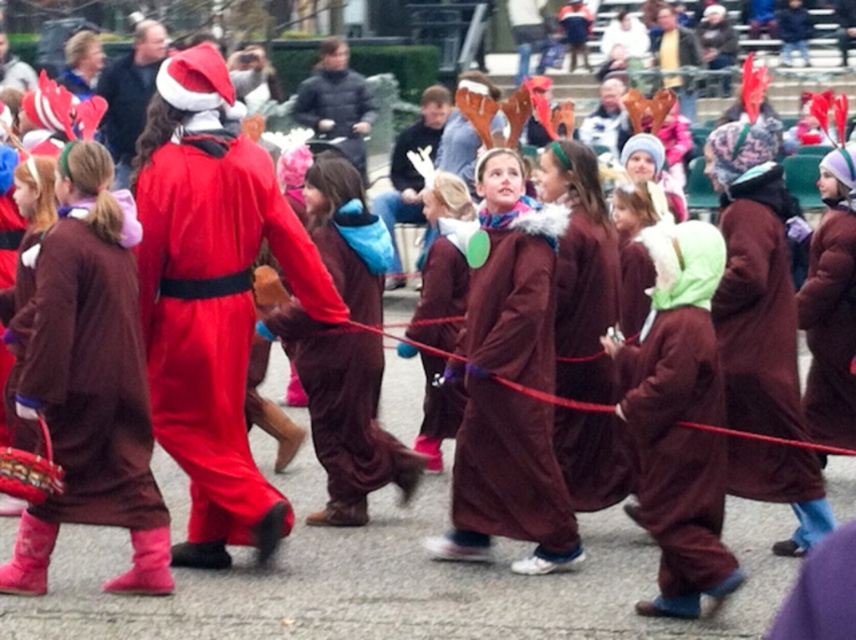
You are a photographer trying to capture a group photo of the velvet santa claus at center and the brown fuzzy coat at center. If your camera has a maximum focus range of 30 inches, will you be able to capture both subjects clearly in the same photo?

The distance between the velvet santa claus at center and the brown fuzzy coat at center is 29.50 inches, which is within the camera maximum focus range of 30 inches. Therefore, both subjects can be captured clearly in the same photo.

You are organizing a costume parade and need to ensure that the velvet santa claus at center and the brown velvet robe at center can fit side by side on a 2.5 meter wide stage. Given their sizes, will they both fit comfortably without overlapping?

The velvet santa claus at center is wider than the brown velvet robe at center. Since the total width of both would exceed 2.5 meters, they may not fit comfortably side by side on the stage.

You are a photographer at the event and want to capture a photo of the velvet santa claus at center and the brown fuzzy robe at center. The director says the Santa should be on the left side of the photo. Can you adjust your position to make this happen?

The velvet santa claus at center is currently to the right of the brown fuzzy robe at center. To have the Santa on the left side of the photo, you need to position yourself so that the velvet santa claus at center appears to the left of the brown fuzzy robe at center. This might involve moving to the right side of the group so that the Santa, who is originally to the right, now shifts to the left in your frame.